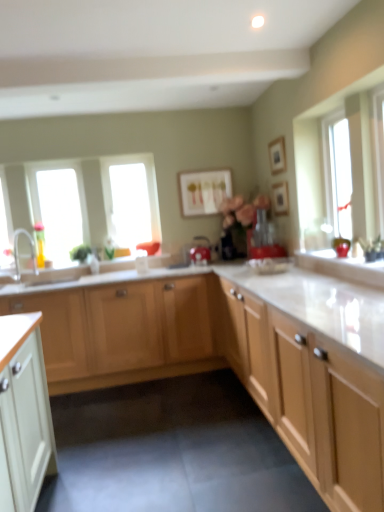
Question: Should I look upward or downward to see wooden picture frame at upper center, acting as the first picture frame starting from the front?

Choices:
 (A) down
 (B) up

Answer: (B)

Question: Is matte white picture frame at center, the first picture frame from the left, oriented towards silver metallic faucet at left?

Choices:
 (A) no
 (B) yes

Answer: (A)

Question: Is matte white picture frame at center, the 1th picture frame in the back-to-front sequence, positioned behind silver metallic faucet at left?

Choices:
 (A) no
 (B) yes

Answer: (B)

Question: Considering the relative sizes of matte white picture frame at center, the first picture frame from the left, and silver metallic faucet at left in the image provided, is matte white picture frame at center, the first picture frame from the left, bigger than silver metallic faucet at left?

Choices:
 (A) no
 (B) yes

Answer: (A)

Question: Considering the relative sizes of matte white picture frame at center, the 1th picture frame in the back-to-front sequence, and silver metallic faucet at left in the image provided, is matte white picture frame at center, the 1th picture frame in the back-to-front sequence, taller than silver metallic faucet at left?

Choices:
 (A) no
 (B) yes

Answer: (A)

Question: Considering the relative positions of matte white picture frame at center, the third picture frame viewed from the front, and silver metallic faucet at left in the image provided, is matte white picture frame at center, the third picture frame viewed from the front, to the left of silver metallic faucet at left from the viewer's perspective?

Choices:
 (A) yes
 (B) no

Answer: (B)

Question: Is matte white picture frame at center, the third picture frame viewed from the front, with silver metallic faucet at left?

Choices:
 (A) yes
 (B) no

Answer: (B)

Question: Is there a large distance between light wood cabinet at center, the 2th cabinetry viewed from the front, and transparent glass window at upper right, which is counted as the first window, starting from the right?

Choices:
 (A) yes
 (B) no

Answer: (A)

Question: From a real-world perspective, is light wood cabinet at center, which is the 1th cabinetry from back to front, on transparent glass window at upper right, which is counted as the first window, starting from the right?

Choices:
 (A) yes
 (B) no

Answer: (B)

Question: Is light wood cabinet at center, the 2th cabinetry viewed from the front, at the left side of transparent glass window at upper right, the first window positioned from the front?

Choices:
 (A) no
 (B) yes

Answer: (B)

Question: Does light wood cabinet at center, the 2th cabinetry viewed from the front, lie behind transparent glass window at upper right, placed as the 3th window when sorted from left to right?

Choices:
 (A) yes
 (B) no

Answer: (A)

Question: Does light wood cabinet at center, the 2th cabinetry viewed from the front, have a lesser width compared to transparent glass window at upper right, the first window positioned from the front?

Choices:
 (A) no
 (B) yes

Answer: (A)

Question: Can you confirm if light wood cabinet at center, which is the 1th cabinetry from back to front, is bigger than transparent glass window at upper right, placed as the 3th window when sorted from left to right?

Choices:
 (A) yes
 (B) no

Answer: (A)

Question: Can you confirm if matte red kettle at center, which appears as the 2th appliance when viewed from the right, is positioned to the right of transparent glass window at center, positioned as the 1th window in back-to-front order?

Choices:
 (A) no
 (B) yes

Answer: (B)